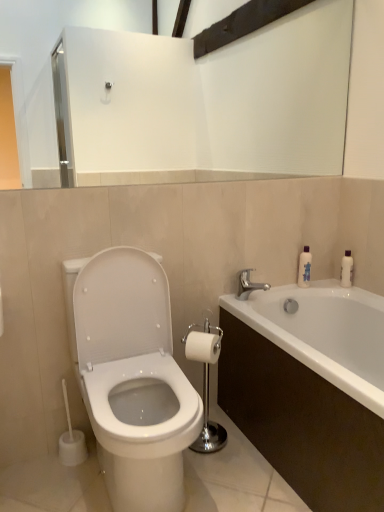
Question: Can you confirm if white matte toilet paper at center is wider than silver metallic faucet at upper right?

Choices:
 (A) no
 (B) yes

Answer: (A)

Question: Is white matte toilet paper at center aimed at silver metallic faucet at upper right?

Choices:
 (A) no
 (B) yes

Answer: (A)

Question: Is white matte toilet paper at center outside silver metallic faucet at upper right?

Choices:
 (A) yes
 (B) no

Answer: (A)

Question: Does white matte toilet paper at center have a lesser width compared to silver metallic faucet at upper right?

Choices:
 (A) no
 (B) yes

Answer: (B)

Question: From a real-world perspective, is white matte toilet paper at center over silver metallic faucet at upper right?

Choices:
 (A) no
 (B) yes

Answer: (A)

Question: Choose the correct answer: Is white glossy bathtub at lower right inside silver metallic faucet at upper right or outside it?

Choices:
 (A) inside
 (B) outside

Answer: (B)

Question: Considering their positions, is white glossy bathtub at lower right located in front of or behind silver metallic faucet at upper right?

Choices:
 (A) behind
 (B) front

Answer: (B)

Question: Is white glossy bathtub at lower right wider or thinner than silver metallic faucet at upper right?

Choices:
 (A) wide
 (B) thin

Answer: (A)

Question: Considering the positions of point (271, 312) and point (248, 272), is point (271, 312) closer or farther from the camera than point (248, 272)?

Choices:
 (A) closer
 (B) farther

Answer: (B)

Question: Would you say white glossy toilet at left is to the left or to the right of polished chrome toilet paper holder at center in the picture?

Choices:
 (A) left
 (B) right

Answer: (A)

Question: Considering the positions of white glossy toilet at left and polished chrome toilet paper holder at center in the image, is white glossy toilet at left wider or thinner than polished chrome toilet paper holder at center?

Choices:
 (A) wide
 (B) thin

Answer: (A)

Question: From a real-world perspective, is white glossy toilet at left physically located above or below polished chrome toilet paper holder at center?

Choices:
 (A) below
 (B) above

Answer: (B)

Question: Is point (122, 452) positioned closer to the camera than point (208, 420)?

Choices:
 (A) farther
 (B) closer

Answer: (B)

Question: Considering the positions of silver metallic faucet at upper right and translucent plastic bottle at upper right in the image, is silver metallic faucet at upper right taller or shorter than translucent plastic bottle at upper right?

Choices:
 (A) tall
 (B) short

Answer: (B)

Question: Is silver metallic faucet at upper right spatially inside translucent plastic bottle at upper right, or outside of it?

Choices:
 (A) inside
 (B) outside

Answer: (B)